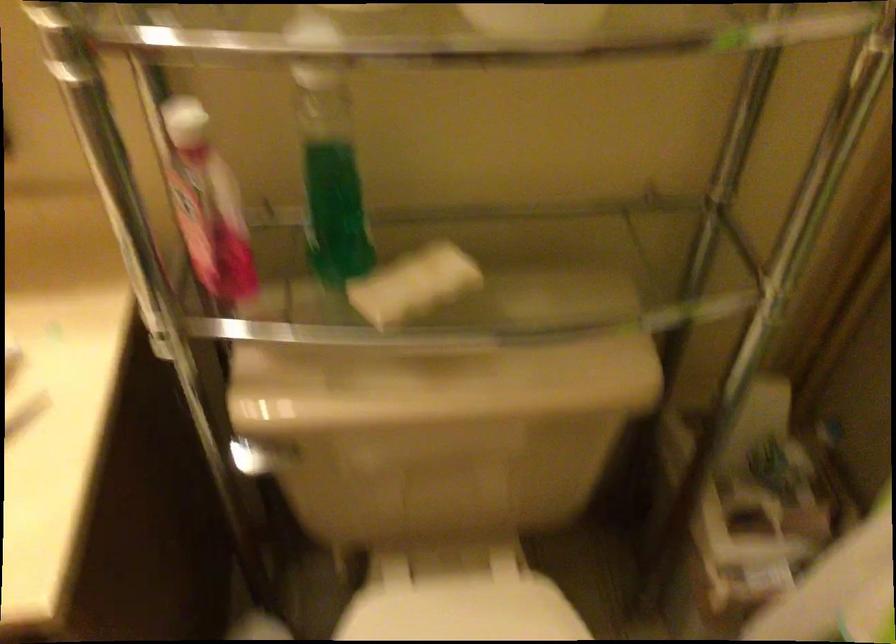
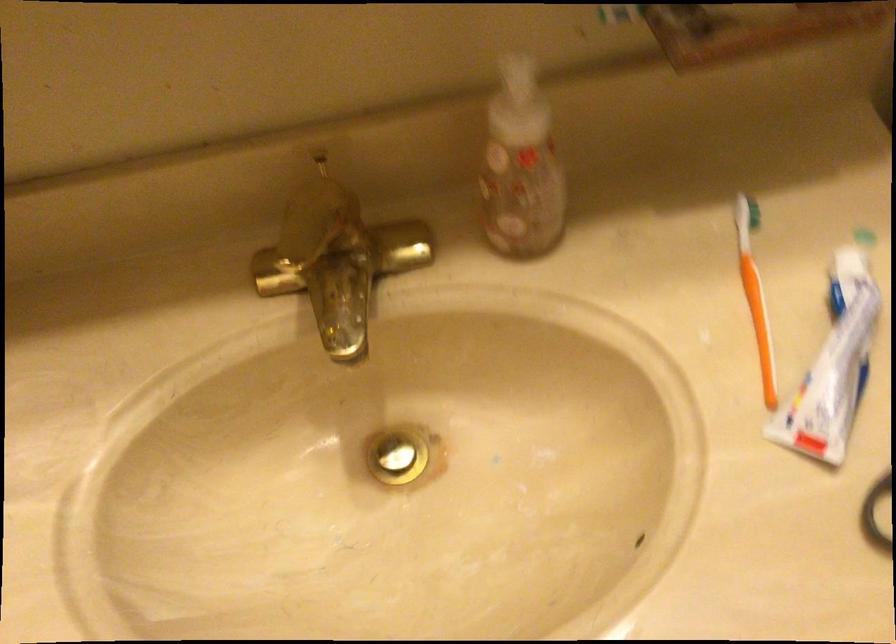
Question: The first image is from the beginning of the video and the second image is from the end. How did the camera likely rotate when shooting the video?

Choices:
 (A) Left
 (B) Right
 (C) Up
 (D) Down

Answer: (D)